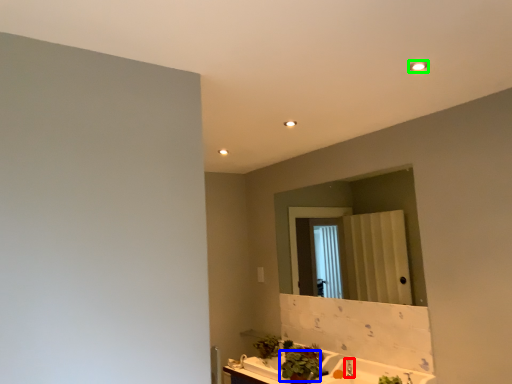
Question: Estimate the real-world distances between objects in this image. Which object is closer to faucet (highlighted by a red box), plant (highlighted by a blue box) or light fixture (highlighted by a green box)?

Choices:
 (A) plant
 (B) light fixture

Answer: (A)